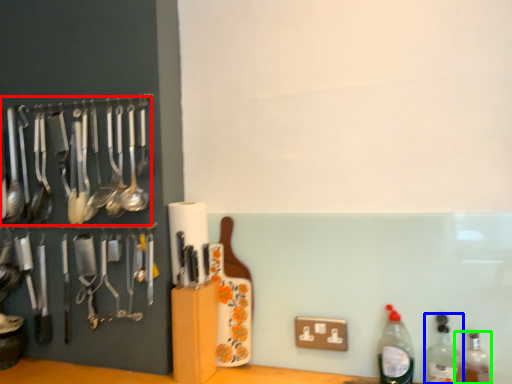
Question: Which is farther away from spoon (highlighted by a red box)? bottle (highlighted by a blue box) or bottle (highlighted by a green box)?

Choices:
 (A) bottle
 (B) bottle

Answer: (B)